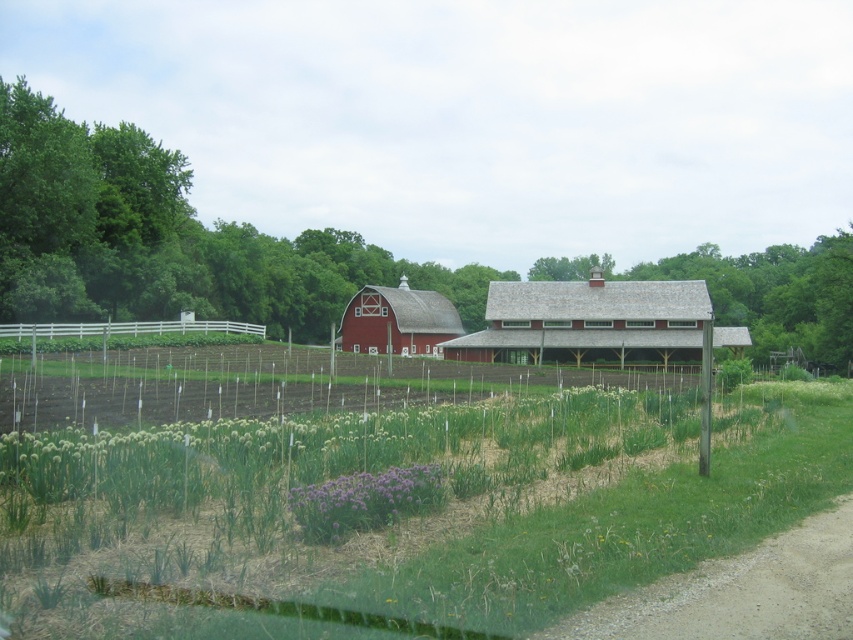
Who is positioned more to the left, green grassy field at lower center or red wooden barn at center?

Positioned to the left is green grassy field at lower center.

Can you confirm if green grassy field at lower center is bigger than red wooden barn at center?

No.

You are a GUI agent. You are given a task and a screenshot of the screen. Output one action in this format:
    pyautogui.click(x=<x>, y=<y>)
    Task: Click on the green grassy field at lower center
    
    Given the screenshot: What is the action you would take?
    pyautogui.click(x=404, y=509)

Locate an element on the screen. green grassy field at lower center is located at coordinates (404, 509).

Between green grassy field at lower center and white wooden fence at left, which one has more height?

green grassy field at lower center

Is point (213, 442) positioned in front of point (173, 324)?

Yes.

Locate an element on the screen. The image size is (853, 640). green grassy field at lower center is located at coordinates (404, 509).

Looking at this image, between purple matte flower at center and matte red barn at center, which one appears on the left side from the viewer's perspective?

matte red barn at center

Is point (373, 486) positioned in front of point (442, 330)?

That is True.

Who is more forward, (386, 486) or (381, 301)?

Point (386, 486)

You are a GUI agent. You are given a task and a screenshot of the screen. Output one action in this format:
    pyautogui.click(x=<x>, y=<y>)
    Task: Click on the purple matte flower at center
    This screenshot has width=853, height=640.
    Given the screenshot: What is the action you would take?
    pyautogui.click(x=364, y=500)